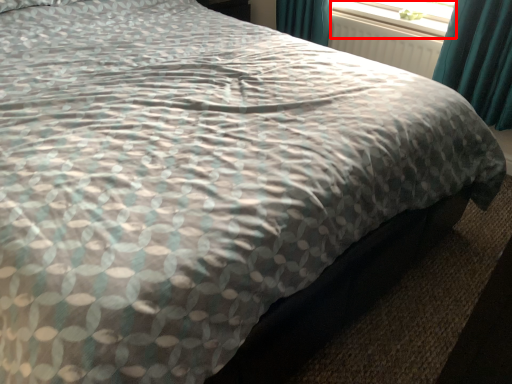
Question: From the image's perspective, what is the correct spatial positioning of window screen (annotated by the red box) in reference to radiator?

Choices:
 (A) below
 (B) above

Answer: (B)